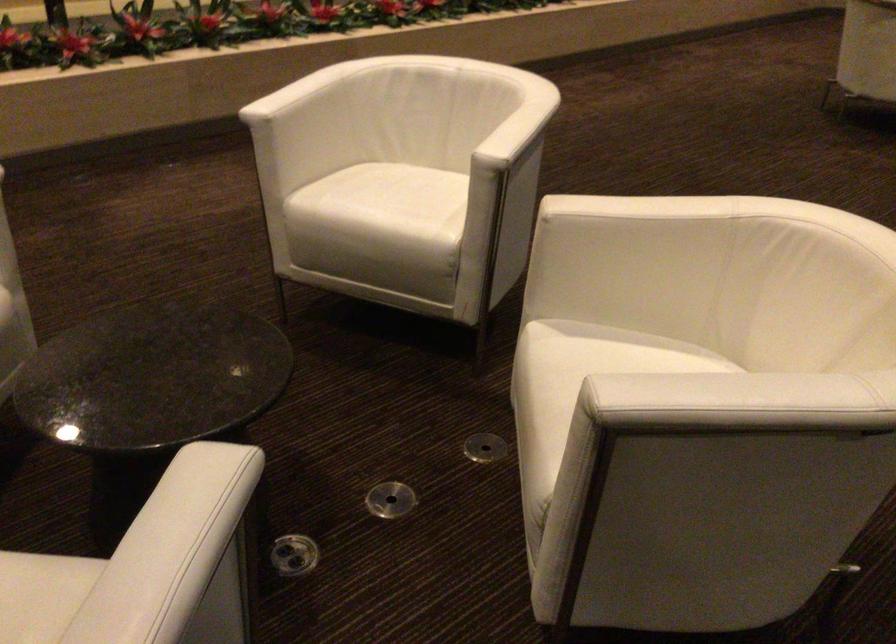
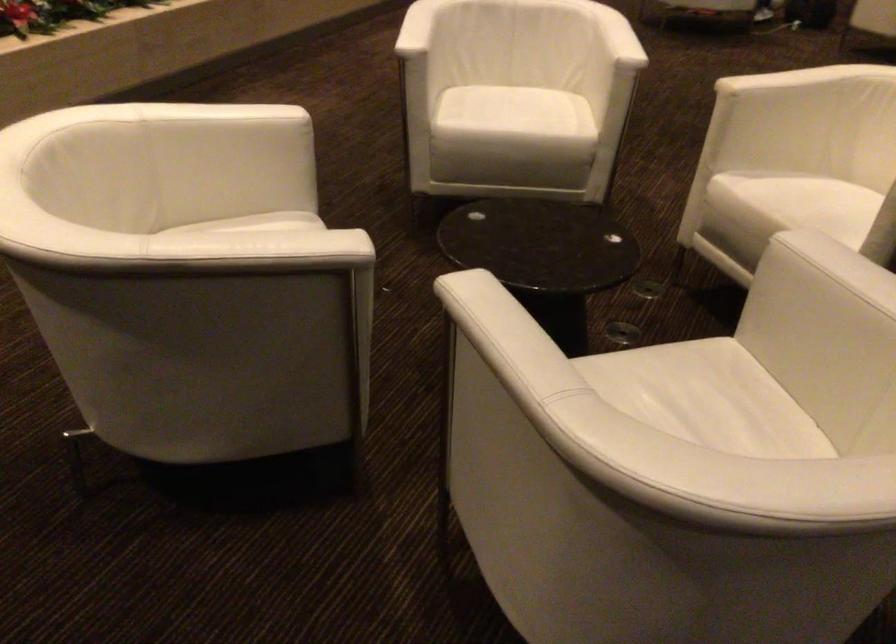
Locate, in the second image, the point that corresponds to point (497, 129) in the first image.

(617, 37)